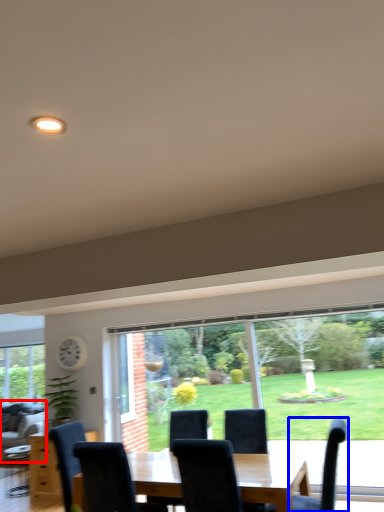
Question: Which point is further to the camera, couch (highlighted by a red box) or chair (highlighted by a blue box)?

Choices:
 (A) couch
 (B) chair

Answer: (A)